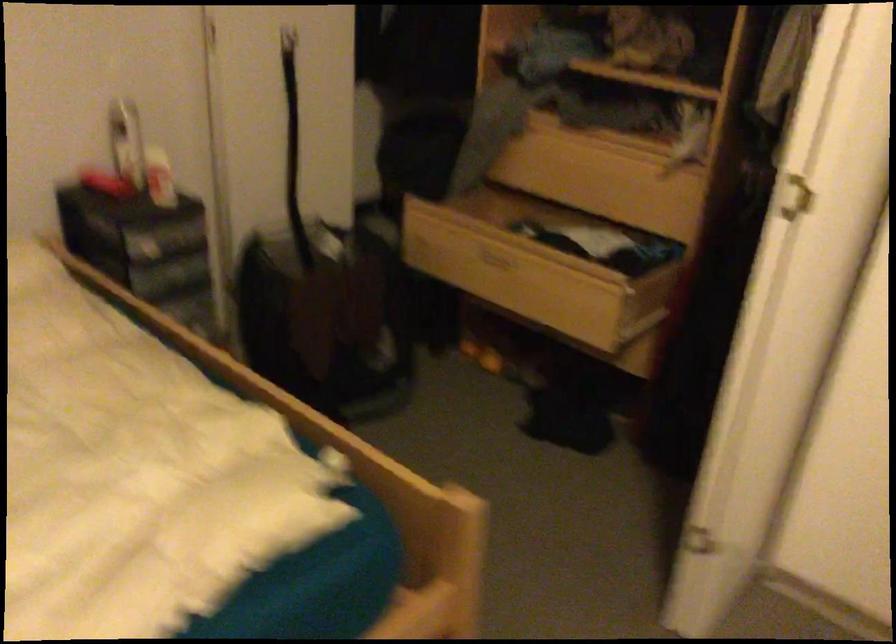
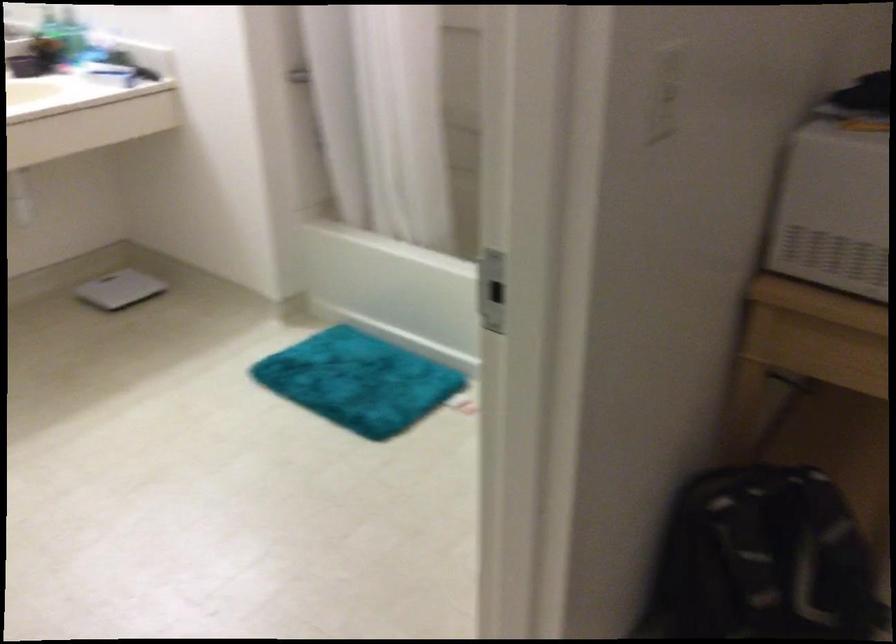
What movement of the cameraman would produce the second image?

The movement direction of the cameraman is right, forward.